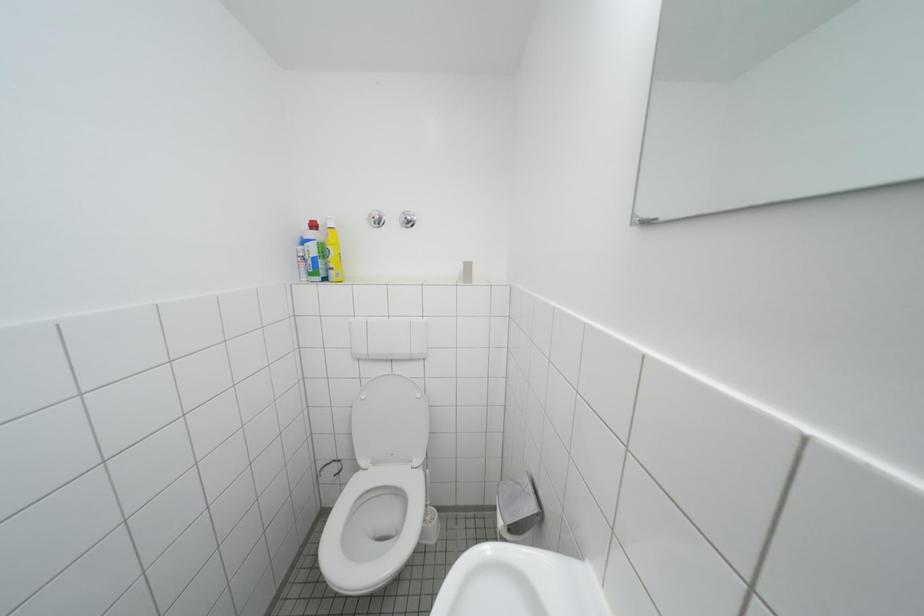
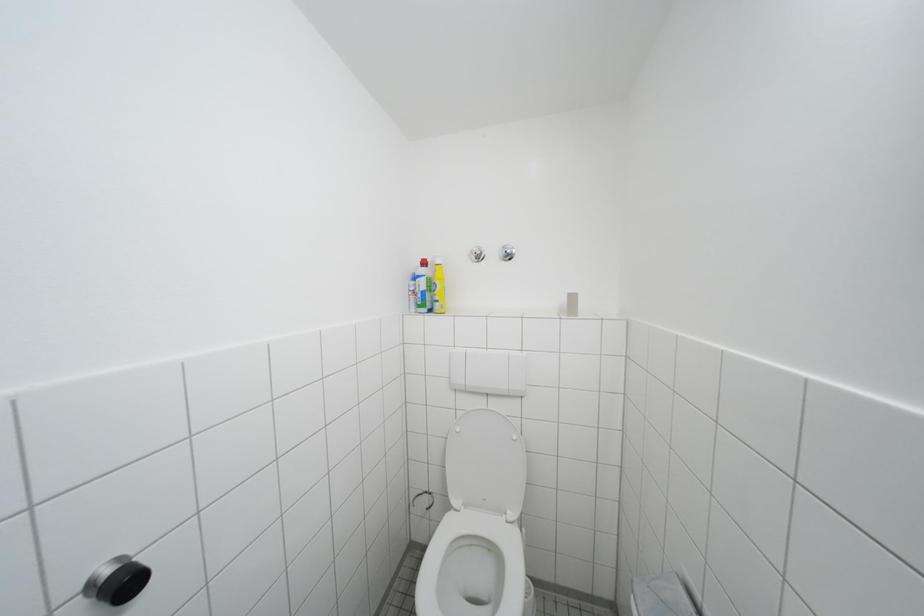
Question: How did the camera likely rotate?

Choices:
 (A) Left
 (B) Right
 (C) Up
 (D) Down

Answer: (A)